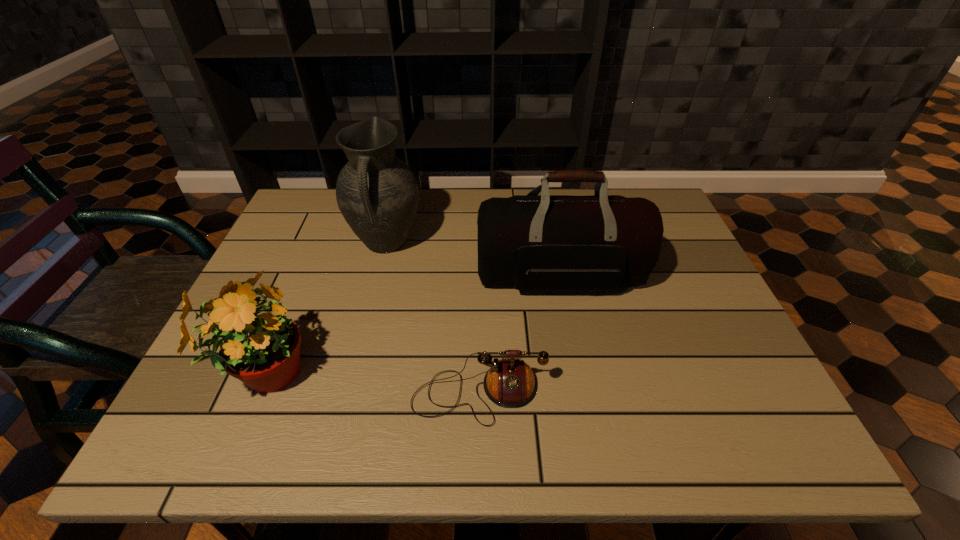
Locate an element on the screen. Image resolution: width=960 pixels, height=540 pixels. vacant region between the pitcher and the duffel bag is located at coordinates (473, 260).

Where is `vacant area that lies between the duffel bag and the flowerpot`? The width and height of the screenshot is (960, 540). vacant area that lies between the duffel bag and the flowerpot is located at coordinates point(412,326).

Find the location of a particular element. The image size is (960, 540). unoccupied position between the duffel bag and the flowerpot is located at coordinates (412, 326).

Where is `free space between the pitcher and the shortest object`? This screenshot has height=540, width=960. free space between the pitcher and the shortest object is located at coordinates (433, 318).

Identify the location of free space between the pitcher and the flowerpot. (324, 309).

Find the location of a particular element. vacant region between the duffel bag and the pitcher is located at coordinates (473, 260).

Where is `free space between the pitcher and the duffel bag`? Image resolution: width=960 pixels, height=540 pixels. free space between the pitcher and the duffel bag is located at coordinates click(473, 260).

Find the location of `vacant area that lies between the shortest object and the flowerpot`. vacant area that lies between the shortest object and the flowerpot is located at coordinates (372, 384).

Image resolution: width=960 pixels, height=540 pixels. In order to click on free area in between the flowerpot and the pitcher in this screenshot , I will do (x=324, y=309).

Choose which object is the third nearest neighbor to the pitcher. Please provide its 2D coordinates. Your answer should be formatted as a tuple, i.e. [(x, y)], where the tuple contains the x and y coordinates of a point satisfying the conditions above.

[(510, 383)]